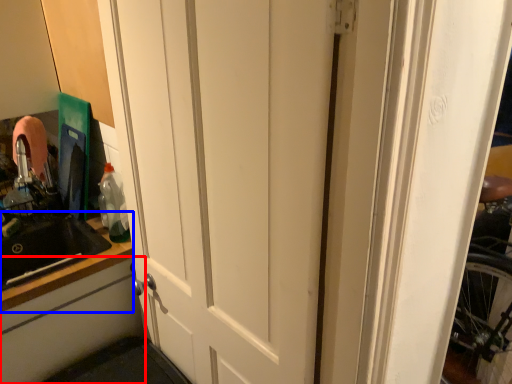
Question: Among these objects, which one is farthest to the camera, cabinetry (highlighted by a red box) or counter top (highlighted by a blue box)?

Choices:
 (A) cabinetry
 (B) counter top

Answer: (B)